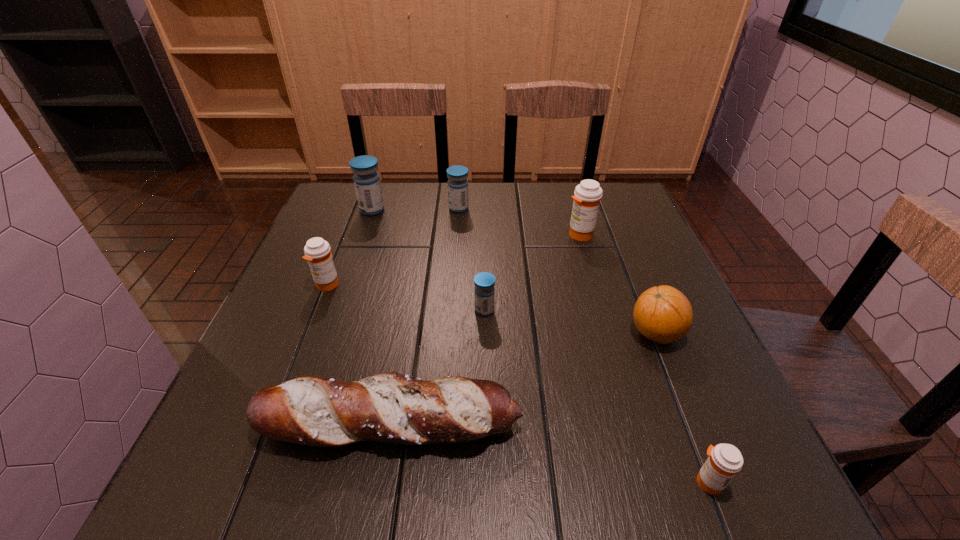
Identify which orange medicine is the second closest to the fourth farthest object. Please provide its 2D coordinates. Your answer should be formatted as a tuple, i.e. [(x, y)], where the tuple contains the x and y coordinates of a point satisfying the conditions above.

[(725, 460)]

The height and width of the screenshot is (540, 960). Find the location of `orange medicine that stands as the closest to the fourth medicine from right to left`. orange medicine that stands as the closest to the fourth medicine from right to left is located at coordinates (587, 195).

Where is `blue medicine that stands as the third closest to the rightmost medicine`? blue medicine that stands as the third closest to the rightmost medicine is located at coordinates (366, 180).

Identify which blue medicine is the closest to the biggest blue medicine. Please provide its 2D coordinates. Your answer should be formatted as a tuple, i.e. [(x, y)], where the tuple contains the x and y coordinates of a point satisfying the conditions above.

[(457, 184)]